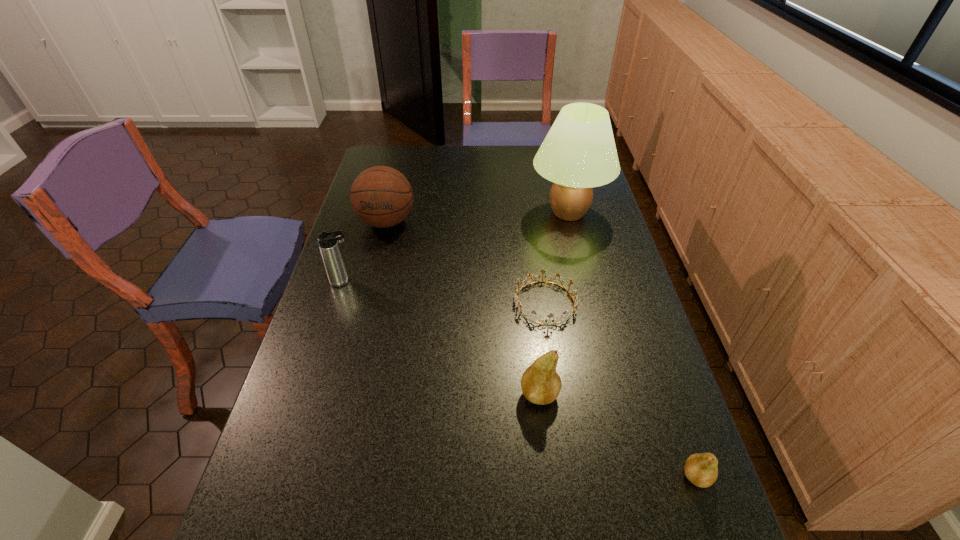
You are a GUI agent. You are given a task and a screenshot of the screen. Output one action in this format:
    pyautogui.click(x=<x>, y=<y>)
    Task: Click on the vacant area that lies between the tiara and the thermos bottle
    This screenshot has height=540, width=960.
    Given the screenshot: What is the action you would take?
    pyautogui.click(x=444, y=292)

In order to click on vacant space that's between the thermos bottle and the basketball in this screenshot , I will do `click(365, 252)`.

Find the location of a particular element. This screenshot has width=960, height=540. free space between the thermos bottle and the tiara is located at coordinates (444, 292).

At what (x,y) coordinates should I click in order to perform the action: click on unoccupied position between the shortest object and the second nearest object. Please return your answer as a coordinate pair (x, y). Looking at the image, I should click on (542, 348).

Find the location of a particular element. This screenshot has height=540, width=960. free space between the tiara and the basketball is located at coordinates (466, 262).

Where is `free spot between the basketball and the nearer pear`? Image resolution: width=960 pixels, height=540 pixels. free spot between the basketball and the nearer pear is located at coordinates (541, 349).

Where is `empty location between the thermos bottle and the tiara`? empty location between the thermos bottle and the tiara is located at coordinates (444, 292).

Where is `the closest object relative to the fifth tallest object`? Image resolution: width=960 pixels, height=540 pixels. the closest object relative to the fifth tallest object is located at coordinates (540, 383).

The height and width of the screenshot is (540, 960). I want to click on object that is the second closest to the right pear, so click(x=518, y=304).

This screenshot has width=960, height=540. In order to click on vacant area that satisfies the following two spatial constraints: 1. on the side with brand label of the nearest object; 2. on the left side of the basketball in this screenshot , I will do `click(323, 476)`.